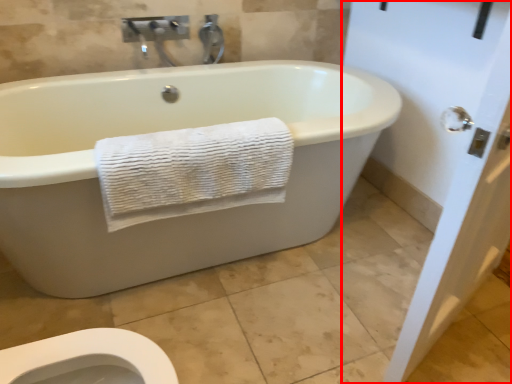
Question: From the image's perspective, what is the correct spatial relationship of screen door (annotated by the red box) in relation to towel?

Choices:
 (A) below
 (B) above

Answer: (A)